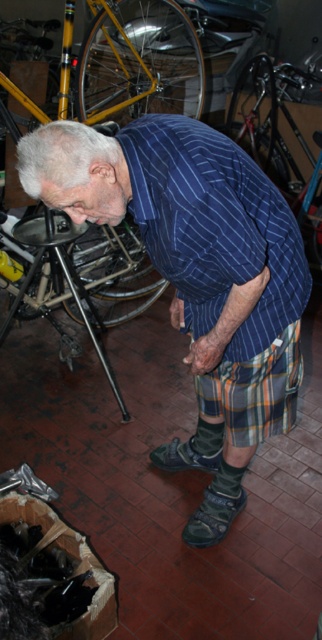
What is the location of the plaid fabric kilt at lower center in the image?

The plaid fabric kilt at lower center is located at point (255, 390).

You are a delivery person who needs to place a large box in this garage. The box is 1.2 meters tall. There is a shiny metallic bicycle at center and a green fabric sandal at lower center in the way. Can the box be placed between them without hitting either object?

The shiny metallic bicycle at center is taller than the green fabric sandal at lower center. Since the box is 1.2 meters tall, it might hit the taller bicycle if placed between them. Check the height clearance between the bicycle and the ceiling or other obstacles before deciding.

You are a delivery person who needs to deliver a package to the workshop. You see the plaid fabric kilt at lower center and the green suede shoe at lower center. Which object is positioned more to the right side?

The plaid fabric kilt at lower center is to the right of the green suede shoe at lower center, so the plaid fabric kilt at lower center is positioned more to the right side.